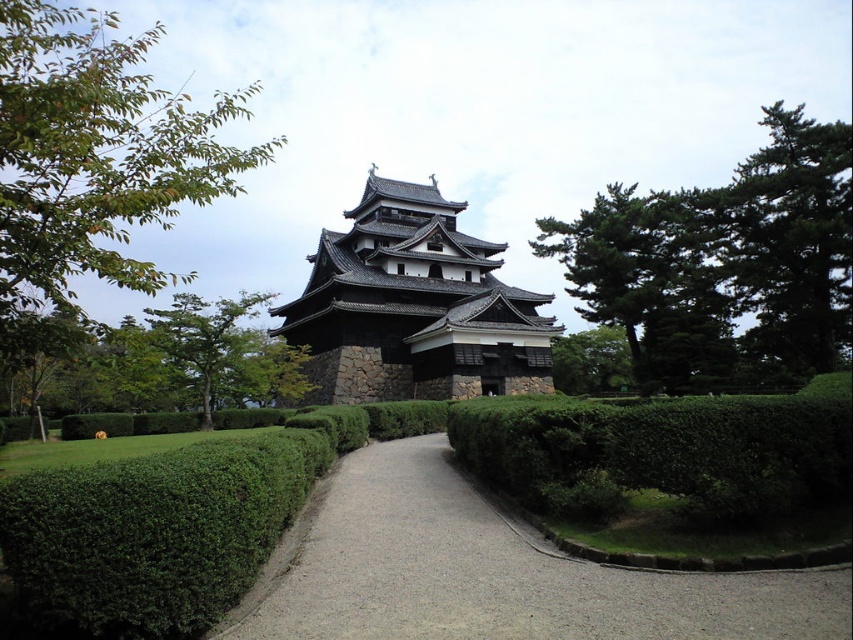
You are a visitor approaching the castle along the pathway. You notice a dark gray stone pagoda at center and a green leafy tree at center. Which one appears taller from your perspective?

The dark gray stone pagoda at center is taller than the green leafy tree at center, so the pagoda appears taller.

You are planning to place a large decorative stone sculpture that is 3 meters wide on the pathway between the green leafy tree at upper right and the green leafy hedge at center. Based on the scene, can the sculpture fit between them without being obstructed by either object?

The green leafy tree at upper right might be wider than the green leafy hedge at center, so there is uncertainty about the available space. To ensure the sculpture fits, you should measure the distance between them first.

You are standing on the pathway leading to the Japanese castle and notice two points marked on the path. The first point is at coordinates point (343, 276) and the second is at point (184, 346). Which point is closer to you as you stand on the pathway?

Point (343, 276) is closer to you because it is further to the viewer than point (184, 346).